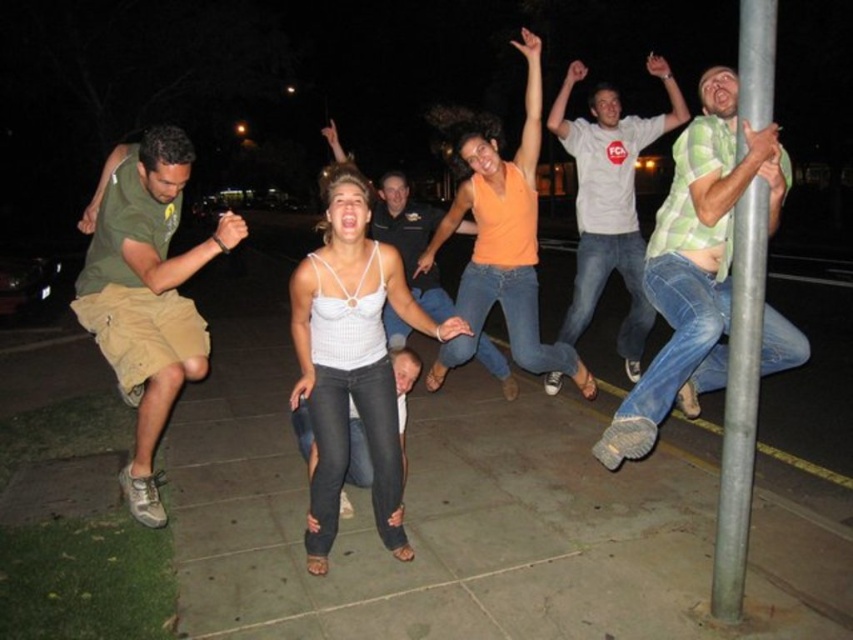
Question: Based on their relative distances, which object is farther from the white knit tank top at center?

Choices:
 (A) green plaid shirt at right
 (B) white tank top at center

Answer: (A)

Question: Does gray concrete pavement at center have a lesser width compared to white knit tank top at center?

Choices:
 (A) yes
 (B) no

Answer: (B)

Question: Does green plaid shirt at right appear on the left side of green cotton shirt at left?

Choices:
 (A) no
 (B) yes

Answer: (A)

Question: Which object is farther from the camera taking this photo?

Choices:
 (A) brushed metal pole at right
 (B) gray concrete pavement at center
 (C) white tank top at center
 (D) green cotton shirt at left

Answer: (C)

Question: Estimate the real-world distances between objects in this image. Which object is closer to the orange sleeveless top at center?

Choices:
 (A) white knit tank top at center
 (B) brushed metal pole at right
 (C) gray concrete pavement at center
 (D) green cotton shirt at left

Answer: (A)

Question: Is gray concrete pavement at center to the left of green cotton shirt at left from the viewer's perspective?

Choices:
 (A) no
 (B) yes

Answer: (A)